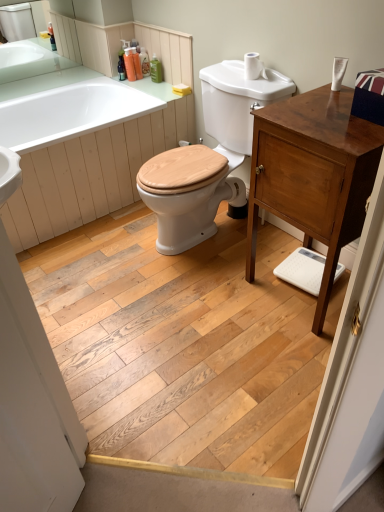
You are a GUI agent. You are given a task and a screenshot of the screen. Output one action in this format:
    pyautogui.click(x=<x>, y=<y>)
    Task: Click on the free spot in front of white glossy sink at upper center, positioned as the 1th sink in bottom-to-top order
    
    Given the screenshot: What is the action you would take?
    pyautogui.click(x=196, y=305)